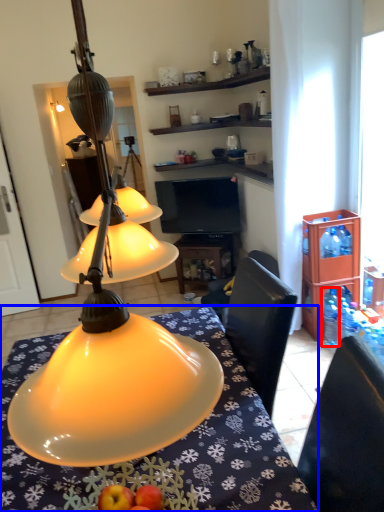
Question: Which of the following is the closest to the observer, bottle (highlighted by a red box) or desk (highlighted by a blue box)?

Choices:
 (A) bottle
 (B) desk

Answer: (B)